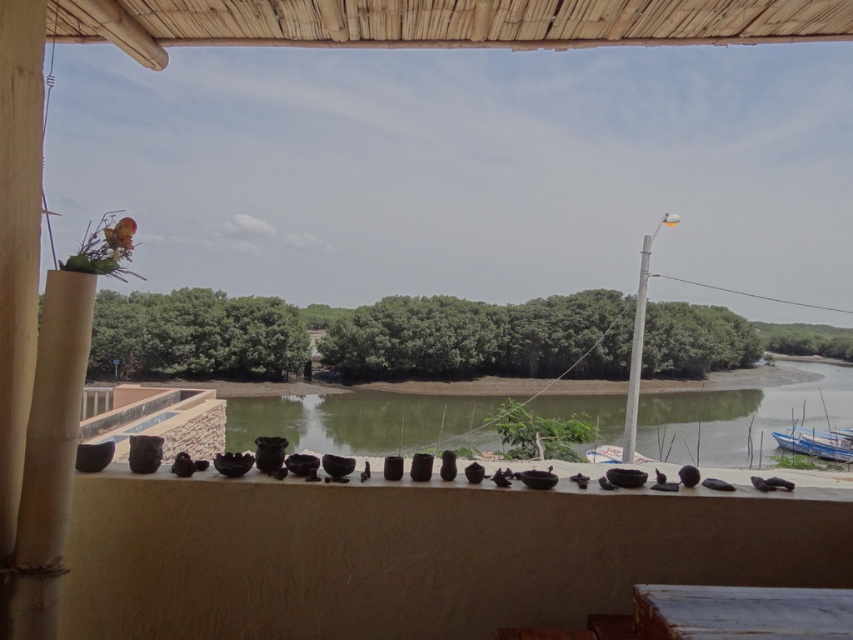
Question: Is matte black bowls at center in front of blue painted wood boat at lower right?

Choices:
 (A) yes
 (B) no

Answer: (A)

Question: Among these objects, which one is nearest to the camera?

Choices:
 (A) blue painted wood boat at lower right
 (B) matte black bowls at center

Answer: (B)

Question: Which point appears farthest from the camera in this image?

Choices:
 (A) (814, 449)
 (B) (187, 628)

Answer: (A)

Question: Is matte black bowls at center in front of blue painted wood boat at lower right?

Choices:
 (A) yes
 (B) no

Answer: (A)

Question: Does matte black bowls at center have a larger size compared to blue painted wood boat at lower right?

Choices:
 (A) yes
 (B) no

Answer: (B)